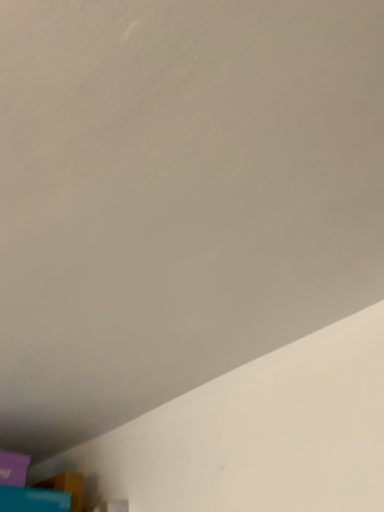
Question: Considering the relative positions of blue cardboard box at lower left and purple matte box at lower left in the image provided, is blue cardboard box at lower left to the left or to the right of purple matte box at lower left?

Choices:
 (A) left
 (B) right

Answer: (B)

Question: Is blue cardboard box at lower left wider or thinner than purple matte box at lower left?

Choices:
 (A) thin
 (B) wide

Answer: (B)

Question: From the image's perspective, is blue cardboard box at lower left located above or below purple matte box at lower left?

Choices:
 (A) below
 (B) above

Answer: (A)

Question: From a real-world perspective, relative to blue cardboard box at lower left, is purple matte box at lower left vertically above or below?

Choices:
 (A) below
 (B) above

Answer: (B)

Question: Is purple matte box at lower left taller or shorter than blue cardboard box at lower left?

Choices:
 (A) tall
 (B) short

Answer: (A)

Question: Is point (26, 457) closer or farther from the camera than point (28, 496)?

Choices:
 (A) farther
 (B) closer

Answer: (A)

Question: Choose the correct answer: Is purple matte box at lower left inside blue cardboard box at lower left or outside it?

Choices:
 (A) outside
 (B) inside

Answer: (A)